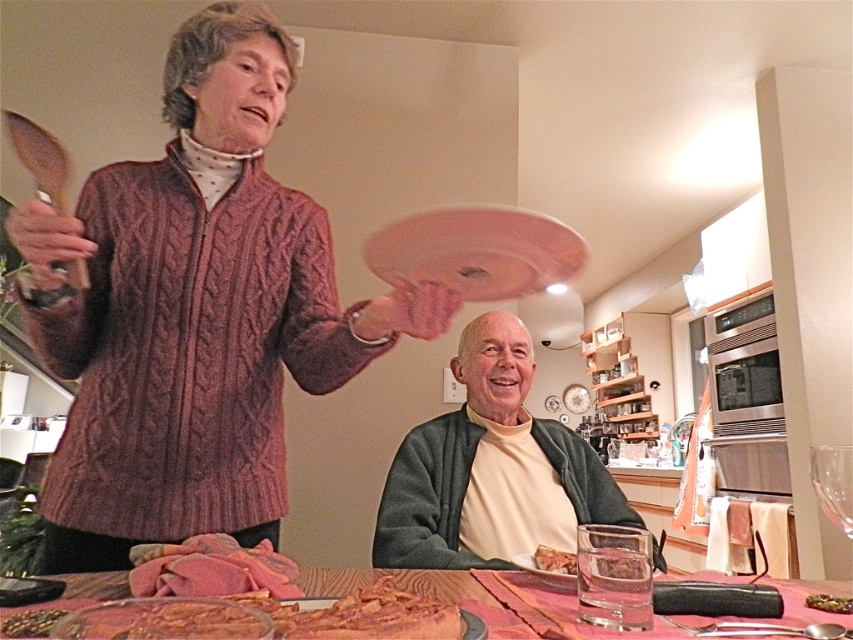
Question: Which object appears closest to the camera in this image?

Choices:
 (A) cable-knit sweater at upper left
 (B) clear glass wine glass at right
 (C) golden brown bread at lower center

Answer: (B)

Question: Is golden brown crispy bacon at lower center smaller than shiny golden seeds at lower left?

Choices:
 (A) no
 (B) yes

Answer: (A)

Question: Which object appears farthest from the camera in this image?

Choices:
 (A) matte green sweater at center
 (B) clear glass wine glass at right
 (C) shiny golden seeds at lower left
 (D) golden brown crispy bacon at lower center

Answer: (A)

Question: Observing the image, what is the correct spatial positioning of cable-knit sweater at upper left in reference to brown crumbly bread at center?

Choices:
 (A) below
 (B) above

Answer: (B)

Question: Which object appears farthest from the camera in this image?

Choices:
 (A) brown crumbly bread at center
 (B) shiny golden seeds at lower left
 (C) golden brown crispy bacon at lower center

Answer: (A)

Question: Can you confirm if cable-knit sweater at upper left is wider than golden brown crispy bacon at lower center?

Choices:
 (A) yes
 (B) no

Answer: (A)